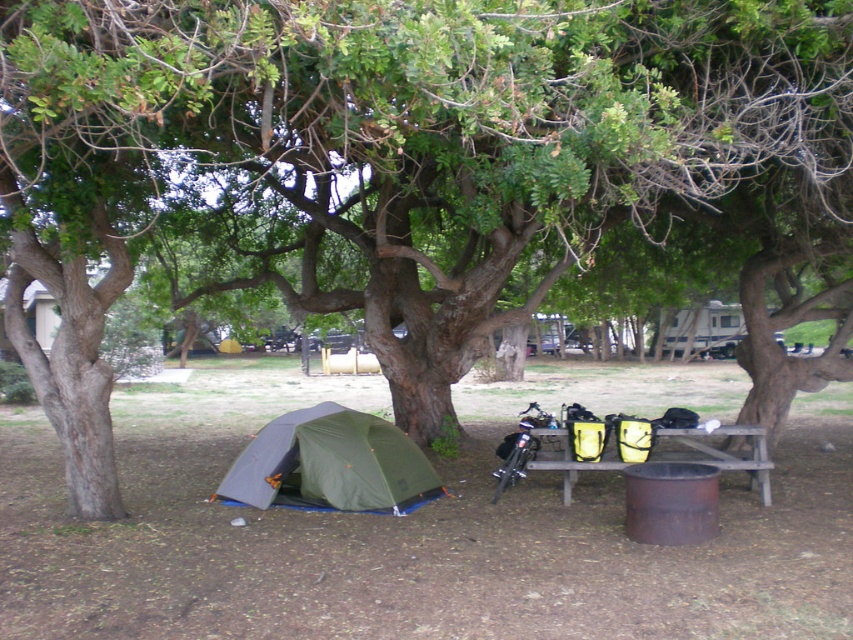
Question: Which point appears farthest from the camera in this image?

Choices:
 (A) (537, 419)
 (B) (306, 476)

Answer: (A)

Question: Does green fabric tent at lower left lie in front of wooden picnic table at center?

Choices:
 (A) yes
 (B) no

Answer: (B)

Question: From the image, what is the correct spatial relationship of green fabric tent at lower left in relation to wooden picnic table at center?

Choices:
 (A) left
 (B) right

Answer: (A)

Question: Which point is closer to the camera?

Choices:
 (A) green fabric tent at lower left
 (B) wooden picnic table at center

Answer: (B)

Question: Is green fabric tent at lower left smaller than wooden picnic table at center?

Choices:
 (A) no
 (B) yes

Answer: (A)